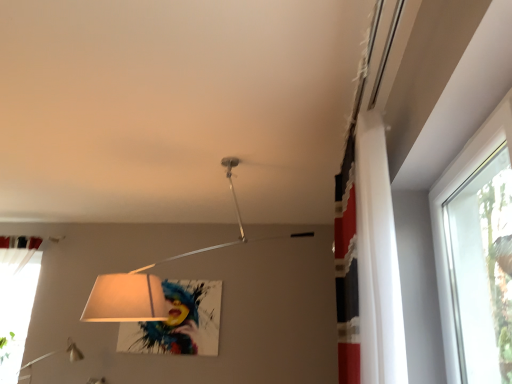
This screenshot has width=512, height=384. Find the location of `white sheer curtain at lower left, the first curtain viewed from the back`. white sheer curtain at lower left, the first curtain viewed from the back is located at coordinates (16, 302).

Where is `matte white lampshade at center`? The image size is (512, 384). matte white lampshade at center is located at coordinates (143, 282).

Is white sheer curtain at lower left, the 2th curtain viewed from the front, to the left or to the right of white fabric curtain at upper right, which appears as the second curtain when viewed from the left, in the image?

From the image, it's evident that white sheer curtain at lower left, the 2th curtain viewed from the front, is to the left of white fabric curtain at upper right, which appears as the second curtain when viewed from the left.

Looking at this image, from a real-world perspective, is white sheer curtain at lower left, the first curtain in the left-to-right sequence, above or below white fabric curtain at upper right, arranged as the 1th curtain when viewed from the front?

From a real-world perspective, white sheer curtain at lower left, the first curtain in the left-to-right sequence, is physically below white fabric curtain at upper right, arranged as the 1th curtain when viewed from the front.

From the image's perspective, who appears lower, white sheer curtain at lower left, the first curtain viewed from the back, or white fabric curtain at upper right, placed as the second curtain when sorted from back to front?

white sheer curtain at lower left, the first curtain viewed from the back, appears lower in the image.

Consider the image. Considering their positions, is white sheer curtain at lower left, the 2th curtain viewed from the front, located in front of or behind white fabric curtain at upper right, arranged as the 1th curtain when viewed from the front?

Clearly, white sheer curtain at lower left, the 2th curtain viewed from the front, is behind white fabric curtain at upper right, arranged as the 1th curtain when viewed from the front.

Who is more distant, transparent glass window at upper right or white sheer curtain at lower left, the first curtain in the left-to-right sequence?

white sheer curtain at lower left, the first curtain in the left-to-right sequence, is further away from the camera.

Considering the sizes of transparent glass window at upper right and white sheer curtain at lower left, which is the second curtain from right to left, in the image, is transparent glass window at upper right bigger or smaller than white sheer curtain at lower left, which is the second curtain from right to left,?

In the image, transparent glass window at upper right appears to be smaller than white sheer curtain at lower left, which is the second curtain from right to left.

What's the angular difference between transparent glass window at upper right and white sheer curtain at lower left, which is the second curtain from right to left,'s facing directions?

The angular difference between transparent glass window at upper right and white sheer curtain at lower left, which is the second curtain from right to left, is 89.6 degrees.

Is transparent glass window at upper right spatially inside white sheer curtain at lower left, the 2th curtain viewed from the front, or outside of it?

The correct answer is: outside.

Is white fabric curtain at upper right, the first curtain when ordered from right to left, located outside matte white lampshade at center?

Absolutely, white fabric curtain at upper right, the first curtain when ordered from right to left, is external to matte white lampshade at center.

Is white fabric curtain at upper right, which appears as the second curtain when viewed from the left, behind matte white lampshade at center?

That is False.

Is point (362, 135) positioned in front of point (160, 315)?

That is True.

Image resolution: width=512 pixels, height=384 pixels. I want to click on lamp that appears on the left of white fabric curtain at upper right, arranged as the 1th curtain when viewed from the front, so click(x=143, y=282).

Considering the points (138, 309) and (26, 297), which point is behind, point (138, 309) or point (26, 297)?

Point (26, 297)

From a real-world perspective, who is located higher, matte white lampshade at center or white sheer curtain at lower left, which is the second curtain from right to left?

In real-world perspective, matte white lampshade at center is above.

Is matte white lampshade at center far from white sheer curtain at lower left, the 2th curtain viewed from the front?

Yes, matte white lampshade at center and white sheer curtain at lower left, the 2th curtain viewed from the front, are located far from each other.

In terms of height, does matte white lampshade at center look taller or shorter compared to white sheer curtain at lower left, the first curtain viewed from the back?

matte white lampshade at center is shorter than white sheer curtain at lower left, the first curtain viewed from the back.

Between white fabric curtain at upper right, the first curtain when ordered from right to left, and transparent glass window at upper right, which one has less height?

transparent glass window at upper right is shorter.

Is white fabric curtain at upper right, placed as the second curtain when sorted from back to front, not close to transparent glass window at upper right?

Actually, white fabric curtain at upper right, placed as the second curtain when sorted from back to front, and transparent glass window at upper right are a little close together.

Is white fabric curtain at upper right, the first curtain when ordered from right to left, facing away from transparent glass window at upper right?

Correct, white fabric curtain at upper right, the first curtain when ordered from right to left, is looking away from transparent glass window at upper right.

Where is `window below the white fabric curtain at upper right, the first curtain when ordered from right to left (from the image's perspective)`? window below the white fabric curtain at upper right, the first curtain when ordered from right to left (from the image's perspective) is located at coordinates (443, 221).

From a real-world perspective, which is physically above, white fabric curtain at upper right, which appears as the second curtain when viewed from the left, or white sheer curtain at lower left, the first curtain in the left-to-right sequence?

white fabric curtain at upper right, which appears as the second curtain when viewed from the left, from a real-world perspective.

Considering the positions of objects white fabric curtain at upper right, placed as the second curtain when sorted from back to front, and white sheer curtain at lower left, the first curtain in the left-to-right sequence, in the image provided, who is more to the right, white fabric curtain at upper right, placed as the second curtain when sorted from back to front, or white sheer curtain at lower left, the first curtain in the left-to-right sequence,?

white fabric curtain at upper right, placed as the second curtain when sorted from back to front.

Who is taller, white fabric curtain at upper right, the first curtain when ordered from right to left, or white sheer curtain at lower left, the first curtain viewed from the back?

With more height is white sheer curtain at lower left, the first curtain viewed from the back.

Is white sheer curtain at lower left, the first curtain viewed from the back, located within white fabric curtain at upper right, arranged as the 1th curtain when viewed from the front?

No, white sheer curtain at lower left, the first curtain viewed from the back, is not surrounded by white fabric curtain at upper right, arranged as the 1th curtain when viewed from the front.

From a real-world perspective, is matte white lampshade at center positioned over white fabric curtain at upper right, the first curtain when ordered from right to left, based on gravity?

Yes, from a real-world perspective, matte white lampshade at center is over white fabric curtain at upper right, the first curtain when ordered from right to left

Between matte white lampshade at center and white fabric curtain at upper right, placed as the second curtain when sorted from back to front, which one has smaller size?

white fabric curtain at upper right, placed as the second curtain when sorted from back to front, is smaller.

Could you tell me if matte white lampshade at center is turned towards white fabric curtain at upper right, the first curtain when ordered from right to left?

No, matte white lampshade at center is not aimed at white fabric curtain at upper right, the first curtain when ordered from right to left.

Find the location of a particular element. Image resolution: width=512 pixels, height=384 pixels. curtain in front of the white sheer curtain at lower left, the first curtain viewed from the back is located at coordinates (377, 259).

The height and width of the screenshot is (384, 512). In order to click on curtain that is below the transparent glass window at upper right (from the image's perspective) in this screenshot , I will do `click(16, 302)`.

Based on their spatial positions, is matte white lampshade at center or transparent glass window at upper right closer to white fabric curtain at upper right, the first curtain when ordered from right to left?

Among the two, transparent glass window at upper right is located nearer to white fabric curtain at upper right, the first curtain when ordered from right to left.

Considering their positions, is white fabric curtain at upper right, placed as the second curtain when sorted from back to front, positioned further to white sheer curtain at lower left, the first curtain viewed from the back, than matte white lampshade at center?

The object further to white sheer curtain at lower left, the first curtain viewed from the back, is white fabric curtain at upper right, placed as the second curtain when sorted from back to front.

From the image, which object appears to be farther from matte white lampshade at center, white fabric curtain at upper right, placed as the second curtain when sorted from back to front, or white sheer curtain at lower left, the first curtain in the left-to-right sequence?

white sheer curtain at lower left, the first curtain in the left-to-right sequence, is further to matte white lampshade at center.

Considering their positions, is transparent glass window at upper right positioned further to matte white lampshade at center than white fabric curtain at upper right, the first curtain when ordered from right to left?

transparent glass window at upper right lies further to matte white lampshade at center than the other object.

When comparing their distances from white fabric curtain at upper right, the first curtain when ordered from right to left, does transparent glass window at upper right or white sheer curtain at lower left, which is the second curtain from right to left, seem further?

The object further to white fabric curtain at upper right, the first curtain when ordered from right to left, is white sheer curtain at lower left, which is the second curtain from right to left.

Based on their spatial positions, is white sheer curtain at lower left, the first curtain in the left-to-right sequence, or white fabric curtain at upper right, the first curtain when ordered from right to left, further from transparent glass window at upper right?

Among the two, white sheer curtain at lower left, the first curtain in the left-to-right sequence, is located further to transparent glass window at upper right.

From the image, which object appears to be nearer to matte white lampshade at center, white sheer curtain at lower left, the first curtain in the left-to-right sequence, or white fabric curtain at upper right, which appears as the second curtain when viewed from the left?

white fabric curtain at upper right, which appears as the second curtain when viewed from the left, is closer to matte white lampshade at center.

Looking at the image, which one is located closer to transparent glass window at upper right, white sheer curtain at lower left, the 2th curtain viewed from the front, or matte white lampshade at center?

Based on the image, matte white lampshade at center appears to be nearer to transparent glass window at upper right.

This screenshot has height=384, width=512. Identify the location of lamp between white sheer curtain at lower left, the first curtain viewed from the back, and transparent glass window at upper right. (143, 282).

This screenshot has width=512, height=384. I want to click on lamp situated between white sheer curtain at lower left, the 2th curtain viewed from the front, and white fabric curtain at upper right, arranged as the 1th curtain when viewed from the front, from left to right, so click(x=143, y=282).

Where is `curtain between transparent glass window at upper right and matte white lampshade at center along the z-axis`? The width and height of the screenshot is (512, 384). curtain between transparent glass window at upper right and matte white lampshade at center along the z-axis is located at coordinates (377, 259).

This screenshot has height=384, width=512. What are the coordinates of `curtain between white sheer curtain at lower left, the first curtain in the left-to-right sequence, and transparent glass window at upper right from left to right` in the screenshot? It's located at (377, 259).